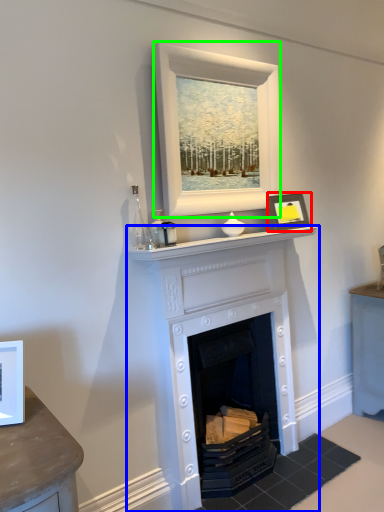
Question: Which is farther away from picture frame (highlighted by a red box)? fireplace (highlighted by a blue box) or picture frame (highlighted by a green box)?

Choices:
 (A) fireplace
 (B) picture frame

Answer: (A)